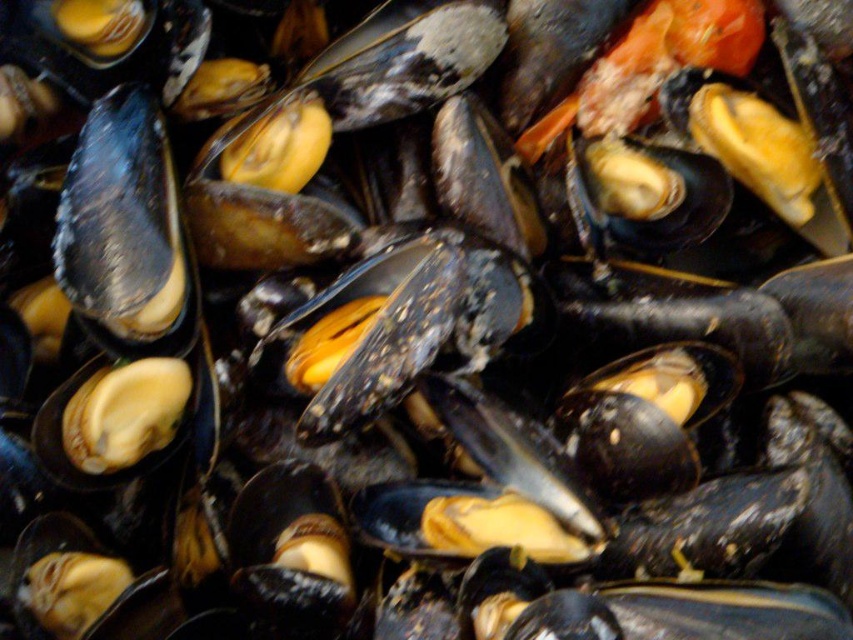
You are a chef arranging mussels on a plate. You have a matte black mussel at upper left and a matte yellow shell at center. The customer wants to place a small herb sprig between them. What is the minimum length of the sprig needed to span the gap?

The distance between the matte black mussel at upper left and the matte yellow shell at center is 5.52 inches, so the herb sprig must be at least 5.52 inches long to span the gap.

You are a food critic examining the dish. Which mussel is positioned closer to you, the matte black mussel at upper left or the matte yellow shell at center?

The matte black mussel at upper left is closer to the viewer than the matte yellow shell at center.